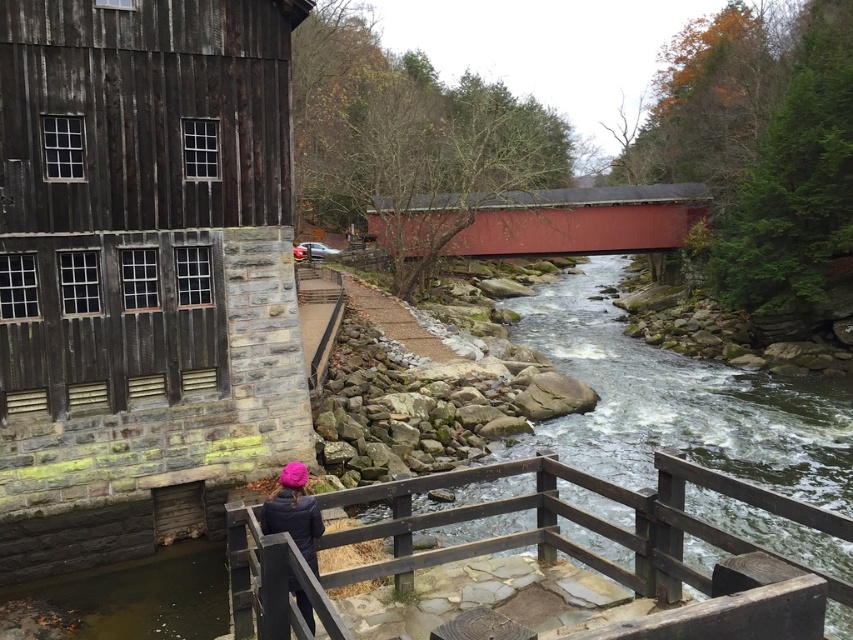
Does wooden rail at center have a lesser width compared to dark blue jacket at center?

No.

Does wooden rail at center have a lesser height compared to dark blue jacket at center?

Yes.

What do you see at coordinates (534, 544) in the screenshot?
I see `wooden rail at center` at bounding box center [534, 544].

The width and height of the screenshot is (853, 640). Identify the location of wooden rail at center. (534, 544).

Does smooth red bridge at center appear on the right side of dark blue jacket at center?

Indeed, smooth red bridge at center is positioned on the right side of dark blue jacket at center.

Who is more distant from viewer, (663, 243) or (297, 472)?

Positioned behind is point (663, 243).

This screenshot has width=853, height=640. Find the location of `smooth red bridge at center`. smooth red bridge at center is located at coordinates (582, 220).

Which of these two, wooden rail at center or smooth red bridge at center, stands shorter?

With less height is wooden rail at center.

Between wooden rail at center and smooth red bridge at center, which one appears on the left side from the viewer's perspective?

wooden rail at center

Does point (596, 486) come behind point (567, 204)?

No.

Where is `wooden rail at center`? The image size is (853, 640). wooden rail at center is located at coordinates (534, 544).